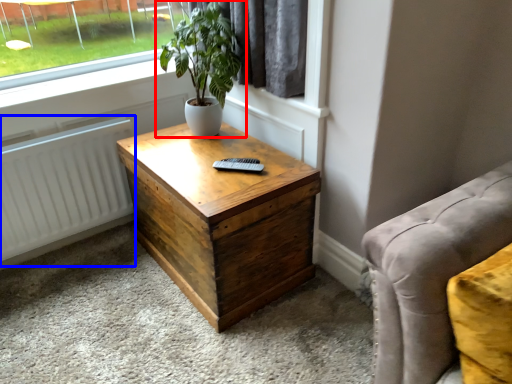
Question: Which of the following is the closest to the observer, houseplant (highlighted by a red box) or radiator (highlighted by a blue box)?

Choices:
 (A) houseplant
 (B) radiator

Answer: (A)